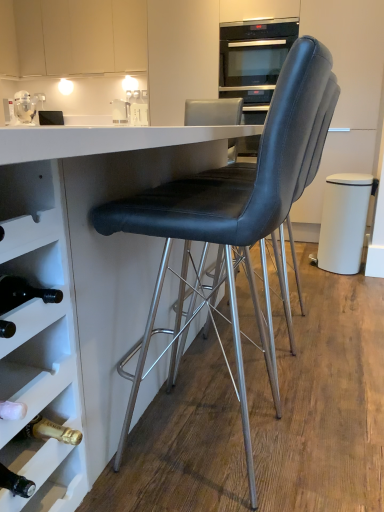
Question: Does black glass oven at upper center have a lesser height compared to white glossy table at center?

Choices:
 (A) no
 (B) yes

Answer: (B)

Question: Is black glass oven at upper center taller than white glossy table at center?

Choices:
 (A) yes
 (B) no

Answer: (B)

Question: Can you confirm if black glass oven at upper center is thinner than white glossy table at center?

Choices:
 (A) no
 (B) yes

Answer: (B)

Question: From the image's perspective, is black glass oven at upper center on white glossy table at center?

Choices:
 (A) no
 (B) yes

Answer: (B)

Question: From a real-world perspective, does black glass oven at upper center sit lower than white glossy table at center?

Choices:
 (A) no
 (B) yes

Answer: (A)

Question: From a real-world perspective, does black glass oven at upper center stand above white glossy table at center?

Choices:
 (A) yes
 (B) no

Answer: (A)

Question: Does black glass oven at upper center have a greater width compared to black leather chair at center, which is the second chair from back to front?

Choices:
 (A) no
 (B) yes

Answer: (A)

Question: From a real-world perspective, is black glass oven at upper center on black leather chair at center, arranged as the 1th chair when viewed from the front?

Choices:
 (A) no
 (B) yes

Answer: (B)

Question: Can you confirm if black glass oven at upper center is shorter than black leather chair at center, arranged as the 1th chair when viewed from the front?

Choices:
 (A) no
 (B) yes

Answer: (B)

Question: Is black glass oven at upper center facing towards black leather chair at center, arranged as the 1th chair when viewed from the front?

Choices:
 (A) yes
 (B) no

Answer: (A)

Question: Is black glass oven at upper center taller than black leather chair at center, arranged as the 1th chair when viewed from the front?

Choices:
 (A) yes
 (B) no

Answer: (B)

Question: Is black leather chair at center, which is the second chair from back to front, completely or partially inside black glass oven at upper center?

Choices:
 (A) no
 (B) yes

Answer: (A)

Question: From the image's perspective, does black leather chair at center, the 2th chair in the front-to-back sequence, appear higher than white matte trash can at right?

Choices:
 (A) yes
 (B) no

Answer: (B)